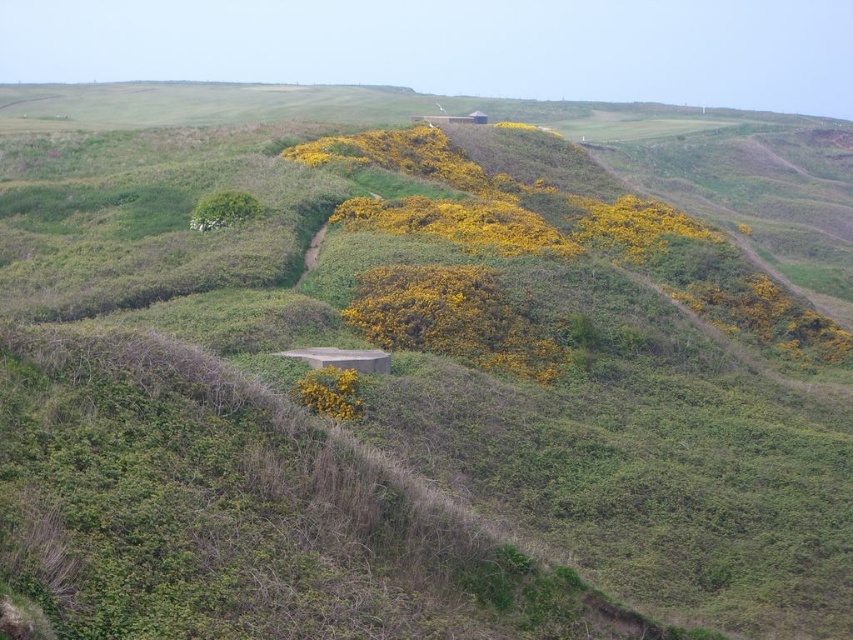
You are an artist planning to paint the scene. You have two yellow matte flowers in your view. The first is labeled as yellow matte flowers at center and the second as yellow matte flower at center. Which of the two has a greater width?

The yellow matte flowers at center has a greater width than the yellow matte flower at center according to the description.

You are a botanist examining the yellow matte flowers at center and the yellow matte flower at center in the image. Which one has a greater height?

The yellow matte flowers at center is taller than the yellow matte flower at center.